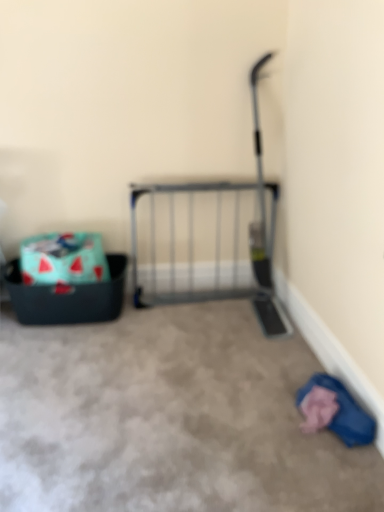
Question: From a real-world perspective, is metal gate at center physically located above or below carpet at center?

Choices:
 (A) below
 (B) above

Answer: (B)

Question: Considering the positions of metal gate at center and carpet at center in the image, is metal gate at center taller or shorter than carpet at center?

Choices:
 (A) short
 (B) tall

Answer: (B)

Question: Estimate the real-world distances between objects in this image. Which object is farther from the watermelon-patterned fabric storage box at left, acting as the 1th storage box starting from the top?

Choices:
 (A) blue fabric at lower right
 (B) metal gate at center
 (C) teal fabric storage box at left, which is the first storage box in bottom-to-top order
 (D) carpet at center

Answer: (A)

Question: Which of these objects is positioned closest to the carpet at center?

Choices:
 (A) watermelon-patterned fabric storage box at left, the second storage box from the bottom
 (B) teal fabric storage box at left, which is the first storage box in bottom-to-top order
 (C) blue fabric at lower right
 (D) metal gate at center

Answer: (C)